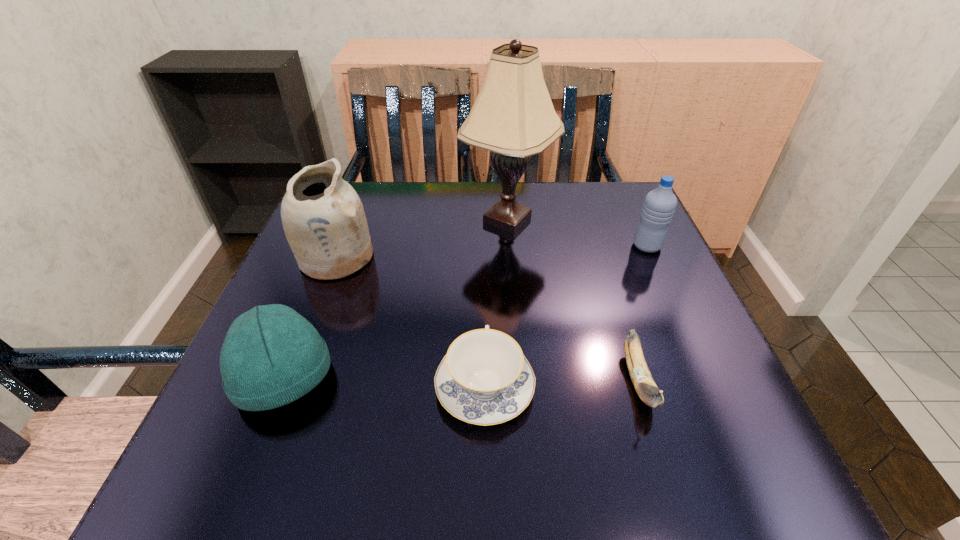
You are a GUI agent. You are given a task and a screenshot of the screen. Output one action in this format:
    pyautogui.click(x=<x>, y=<y>)
    Task: Click on the water bottle that is positioned at the right edge
    The image size is (960, 540).
    Given the screenshot: What is the action you would take?
    pyautogui.click(x=659, y=205)

At what (x,y) coordinates should I click in order to perform the action: click on banana located at the right edge. Please return your answer as a coordinate pair (x, y). Looking at the image, I should click on (647, 390).

Find the location of a particular element. object that is at the far left corner is located at coordinates (323, 218).

Find the location of a particular element. free space at the far edge of the desktop is located at coordinates (496, 195).

In the image, there is a desktop. At what (x,y) coordinates should I click in order to perform the action: click on free space at the near edge. Please return your answer as a coordinate pair (x, y). The image size is (960, 540). Looking at the image, I should click on (437, 486).

Locate an element on the screen. vacant position at the left edge of the desktop is located at coordinates (332, 297).

Where is `vacant space at the right edge of the desktop`? vacant space at the right edge of the desktop is located at coordinates (625, 237).

Locate an element on the screen. vacant space at the near left corner of the desktop is located at coordinates (x=263, y=438).

Locate an element on the screen. blank area at the far right corner is located at coordinates 590,202.

The image size is (960, 540). What are the coordinates of `vacant space that's between the third tallest object and the beanie` in the screenshot? It's located at (466, 312).